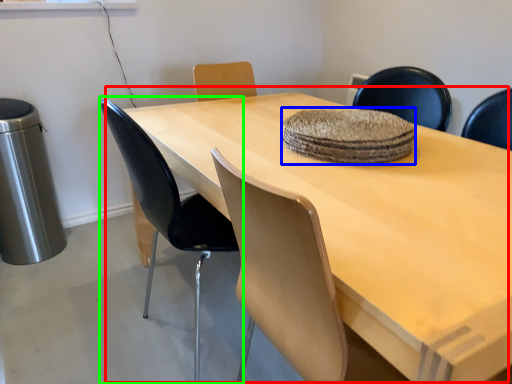
Question: Which is farther away from table (highlighted by a red box)? mat (highlighted by a blue box) or chair (highlighted by a green box)?

Choices:
 (A) mat
 (B) chair

Answer: (B)